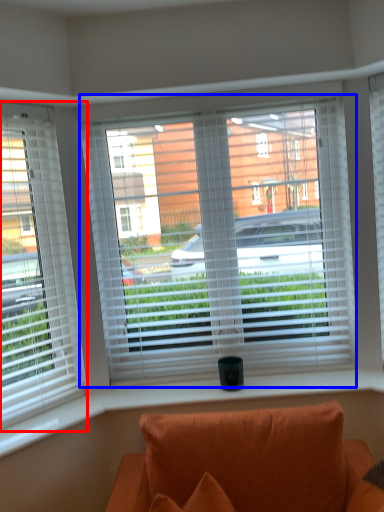
Question: Which object is closer to the camera taking this photo, window (highlighted by a red box) or window (highlighted by a blue box)?

Choices:
 (A) window
 (B) window

Answer: (A)